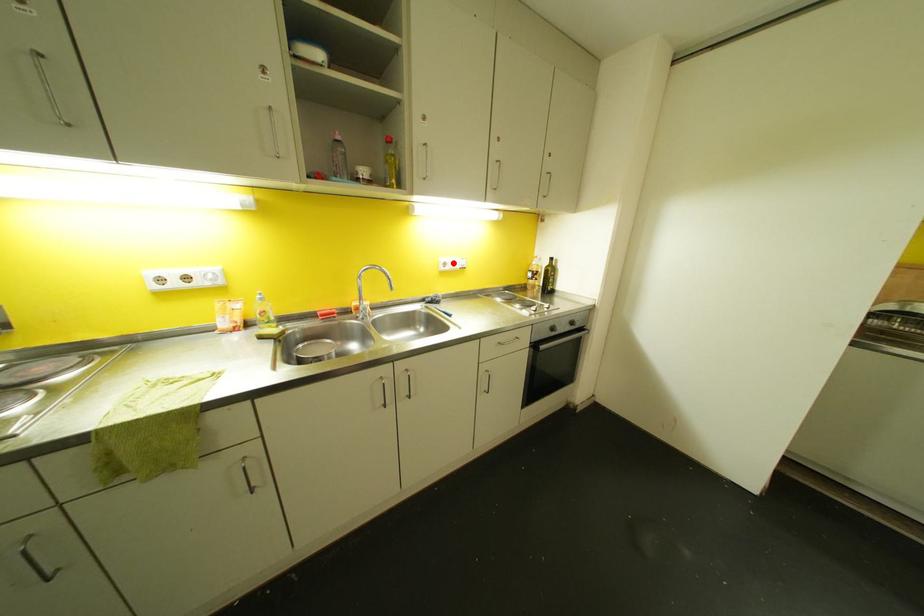
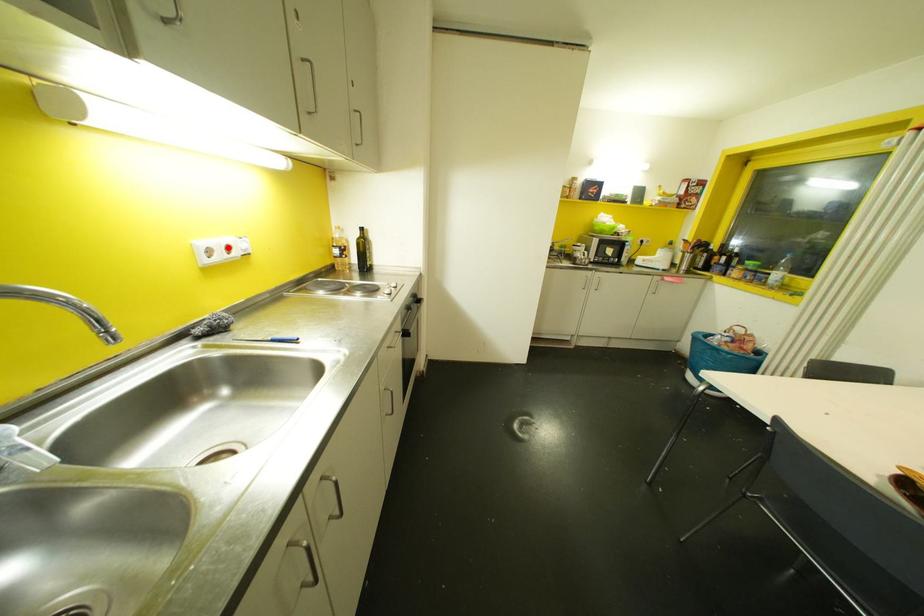
I am providing you with two images of the same scene from different viewpoints. A red point is marked on the first image and another point is marked on the second image. Does the point marked in image1 correspond to the same location as the one in image2?

Yes